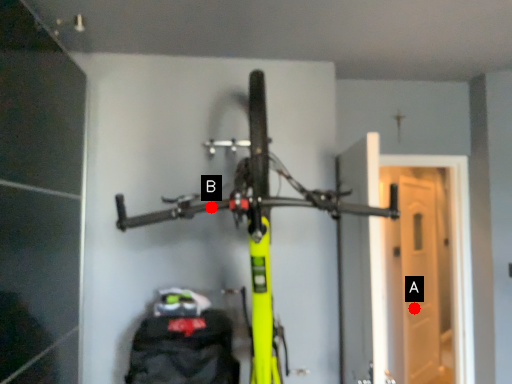
Question: Two points are circled on the image, labeled by A and B beside each circle. Which point is closer to the camera taking this photo?

Choices:
 (A) A is closer
 (B) B is closer

Answer: (B)